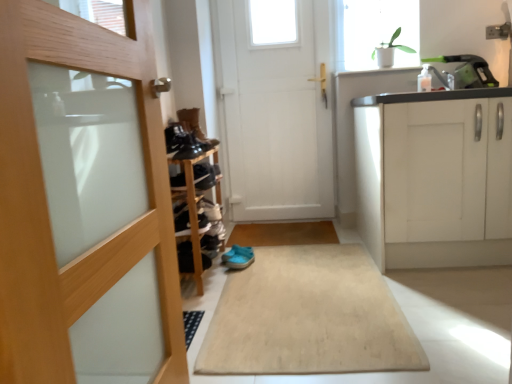
Identify the location of vacant area that lies to the right of light blue fabric slipper at center. (268, 256).